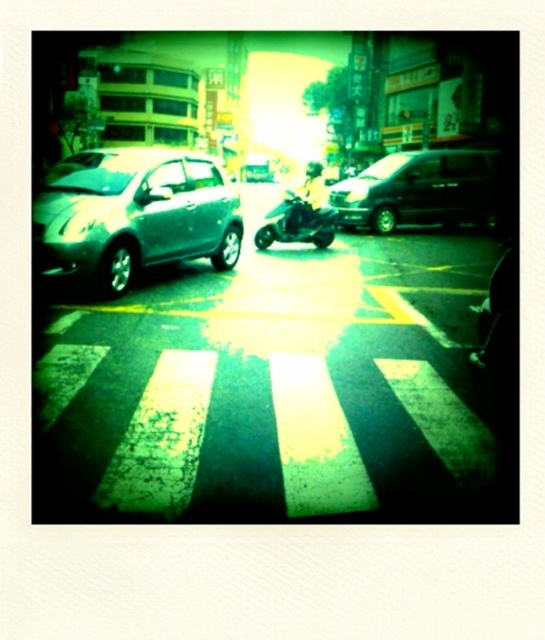
You are a delivery person needing to park your vehicle in a tight space between two other cars. You have a choice between driving a black matte van at center or a green matte motorcycle at center. Which vehicle would you choose to ensure you can fit into the space?

The green matte motorcycle at center is smaller than the black matte van at center, so choosing the green matte motorcycle at center would be better to fit into the tight space.

In the scene shown: You are a delivery person standing at the center of the pedestrian crossing in the image. You need to deliver a package to the address located at the coordinates given in the description. Which direction should you head to reach the satin silver car at left?

The satin silver car at left is located at coordinates point (135, 214), so you should head towards the left direction to reach it.

You are a delivery person trying to navigate through the street. You need to pass between the satin silver car at left and the green matte motorcycle at center. Is there enough space for you to walk through?

The satin silver car at left is positioned under the green matte motorcycle at center, which means they are stacked vertically. Since they are not side by side, there is no horizontal space between them for walking. Therefore, you cannot walk through the space between the satin silver car at left and the green matte motorcycle at center.